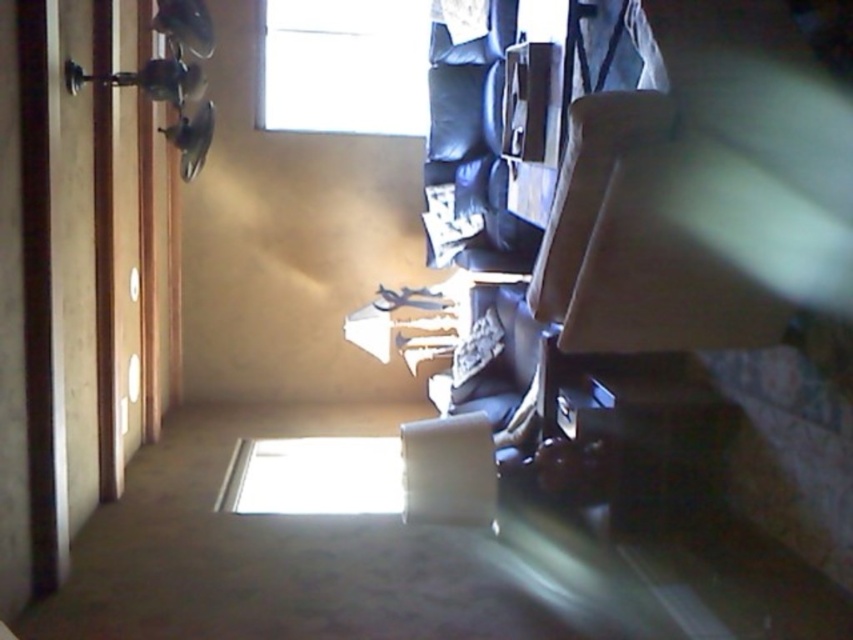
Question: Can you confirm if transparent glass window at upper center is positioned above matte gray armchair at center?

Choices:
 (A) no
 (B) yes

Answer: (B)

Question: Which is farther from the beige fabric armchair at center?

Choices:
 (A) matte gray armchair at center
 (B) transparent glass window at upper center

Answer: (B)

Question: Can you confirm if transparent glass window at upper center is smaller than matte gray armchair at center?

Choices:
 (A) yes
 (B) no

Answer: (B)

Question: Which point is farther to the camera?

Choices:
 (A) (444, 449)
 (B) (337, 44)
 (C) (624, 100)

Answer: (B)

Question: Is transparent glass window at upper center wider than matte gray armchair at center?

Choices:
 (A) no
 (B) yes

Answer: (B)

Question: Which of the following is the farthest from the observer?

Choices:
 (A) beige fabric armchair at center
 (B) transparent glass window at upper center

Answer: (B)